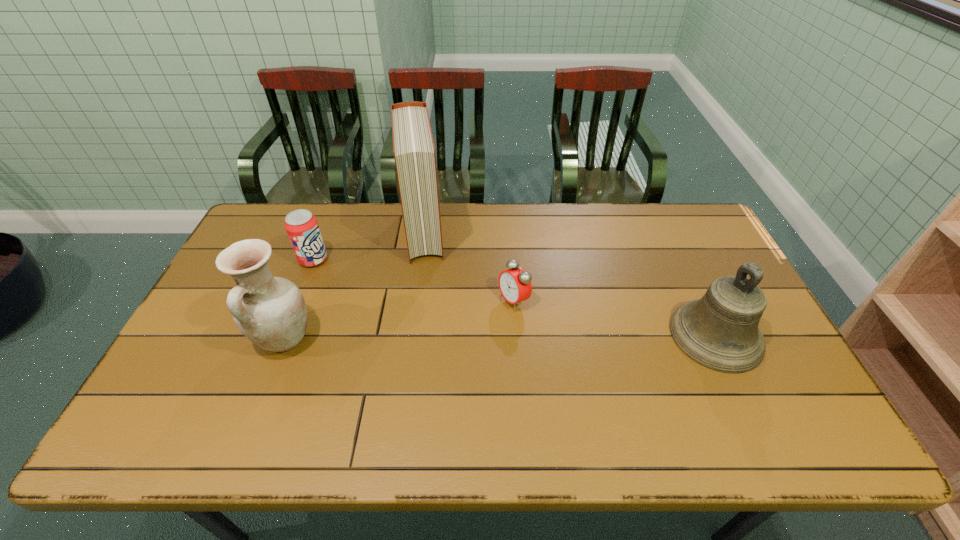
This screenshot has width=960, height=540. Find the location of `free space between the soda can and the alarm clock`. free space between the soda can and the alarm clock is located at coordinates (414, 280).

Image resolution: width=960 pixels, height=540 pixels. I want to click on free space that is in between the pottery and the alarm clock, so click(398, 320).

Locate an element on the screen. The width and height of the screenshot is (960, 540). unoccupied area between the bell and the shortest object is located at coordinates (614, 318).

The width and height of the screenshot is (960, 540). Find the location of `vacant area that lies between the tallest object and the soda can`. vacant area that lies between the tallest object and the soda can is located at coordinates (369, 246).

Where is `object identified as the closest to the soda can`? This screenshot has height=540, width=960. object identified as the closest to the soda can is located at coordinates (271, 312).

Choose which object is the nearest neighbor to the third object from right to left. Please provide its 2D coordinates. Your answer should be formatted as a tuple, i.e. [(x, y)], where the tuple contains the x and y coordinates of a point satisfying the conditions above.

[(515, 286)]

Identify the location of vacant space that satisfies the following two spatial constraints: 1. on the back side of the hardback book; 2. on the left side of the pottery. This screenshot has width=960, height=540. (325, 233).